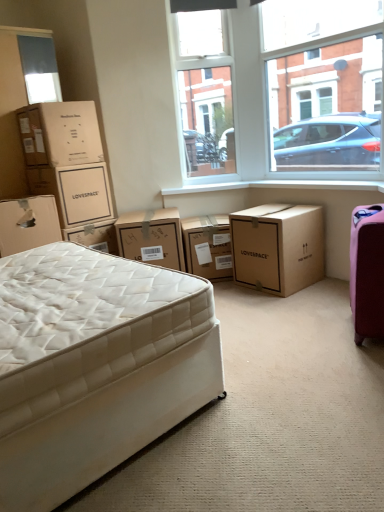
Where is `vacant space that is in between pink fabric suitcase at right and brown cardboard box at center, arranged as the first box when viewed from the right`? vacant space that is in between pink fabric suitcase at right and brown cardboard box at center, arranged as the first box when viewed from the right is located at coordinates (314, 305).